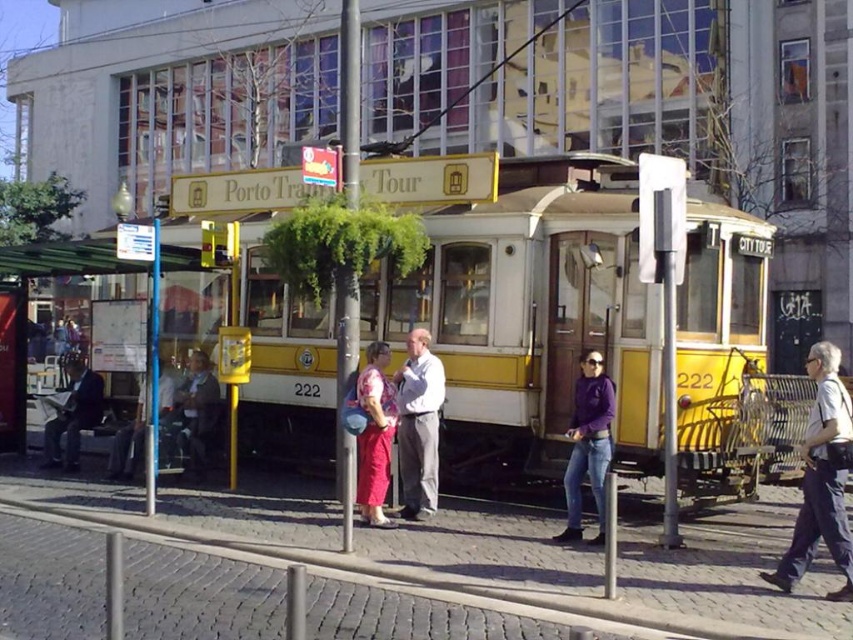
You are a photographer standing at the tram platform. You want to capture a photo of the matte pink dress at center. Where should you position yourself to ensure the dress is centered in your shot?

To center the matte pink dress at center in your photo, position yourself directly in line with its coordinates at point (x=375, y=435).

You are a tourist standing at the platform of the vintage tram. You see the yellow matte cable car at center and the dark brown leather jacket at left. Which object is located to the right of the other?

The yellow matte cable car at center is positioned on the right side of dark brown leather jacket at left, meaning the cable car is to the right of the jacket.